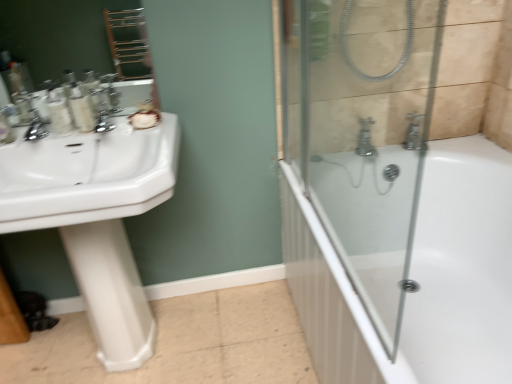
Question: Is white glossy sink at left bigger or smaller than white glossy pedestal at left?

Choices:
 (A) small
 (B) big

Answer: (B)

Question: Do you think white glossy sink at left is within white glossy pedestal at left, or outside of it?

Choices:
 (A) inside
 (B) outside

Answer: (B)

Question: Estimate the real-world distances between objects in this image. Which object is closer to the matte plastic bottles at left, acting as the first toiletry starting from the right?

Choices:
 (A) white glossy pedestal at left
 (B) white glossy sink at left
 (C) white glossy bathtub at center
 (D) matte plastic bottles at left, the 2th toiletry positioned from the right

Answer: (D)

Question: Which object is the farthest from the white glossy sink at left?

Choices:
 (A) white glossy pedestal at left
 (B) white glossy bathtub at center
 (C) matte plastic bottles at left, acting as the first toiletry starting from the right
 (D) matte plastic bottles at left, which appears as the first toiletry when viewed from the left

Answer: (B)